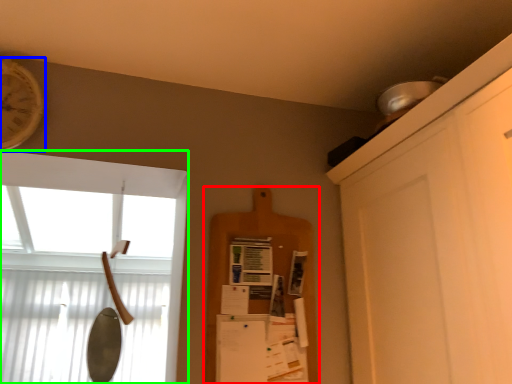
Question: Which is nearer to the shelf (highlighted by a red box)? clock (highlighted by a blue box) or window (highlighted by a green box).

Choices:
 (A) clock
 (B) window

Answer: (A)